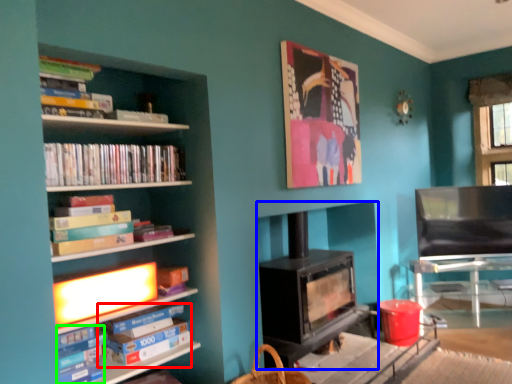
Question: Which is farther away from paperback book (highlighted by a red box)? wood burning stove (highlighted by a blue box) or book (highlighted by a green box)?

Choices:
 (A) wood burning stove
 (B) book

Answer: (A)